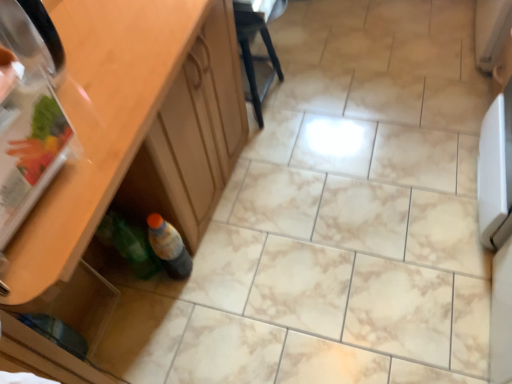
Question: Is translucent plastic bottle at lower left, arranged as the first bottle when viewed from the right, a part of transparent plastic drawer at lower left?

Choices:
 (A) yes
 (B) no

Answer: (B)

Question: Is translucent plastic bottle at lower left, the second bottle viewed from the left, at the back of transparent plastic drawer at lower left?

Choices:
 (A) yes
 (B) no

Answer: (B)

Question: Does transparent plastic drawer at lower left have a lesser height compared to translucent plastic bottle at lower left, arranged as the first bottle when viewed from the right?

Choices:
 (A) yes
 (B) no

Answer: (B)

Question: From the image's perspective, is transparent plastic drawer at lower left under translucent plastic bottle at lower left, the second bottle viewed from the left?

Choices:
 (A) yes
 (B) no

Answer: (A)

Question: Is transparent plastic drawer at lower left at the left side of translucent plastic bottle at lower left, the second bottle viewed from the left?

Choices:
 (A) no
 (B) yes

Answer: (B)

Question: Is transparent plastic drawer at lower left taller than translucent plastic bottle at lower left, the second bottle viewed from the left?

Choices:
 (A) yes
 (B) no

Answer: (A)

Question: From a real-world perspective, is wooden cabinet at lower left positioned over black plastic chair at center based on gravity?

Choices:
 (A) no
 (B) yes

Answer: (B)

Question: Is wooden cabinet at lower left closer to the viewer compared to black plastic chair at center?

Choices:
 (A) no
 (B) yes

Answer: (B)

Question: Is wooden cabinet at lower left outside black plastic chair at center?

Choices:
 (A) no
 (B) yes

Answer: (B)

Question: From the image's perspective, is wooden cabinet at lower left beneath black plastic chair at center?

Choices:
 (A) no
 (B) yes

Answer: (B)

Question: Can you confirm if wooden cabinet at lower left is bigger than black plastic chair at center?

Choices:
 (A) yes
 (B) no

Answer: (A)

Question: From a real-world perspective, is wooden cabinet at lower left below black plastic chair at center?

Choices:
 (A) no
 (B) yes

Answer: (A)

Question: From the image's perspective, is green plastic bottle at lower left, which ranks as the first bottle in left-to-right order, below black plastic chair at center?

Choices:
 (A) yes
 (B) no

Answer: (A)